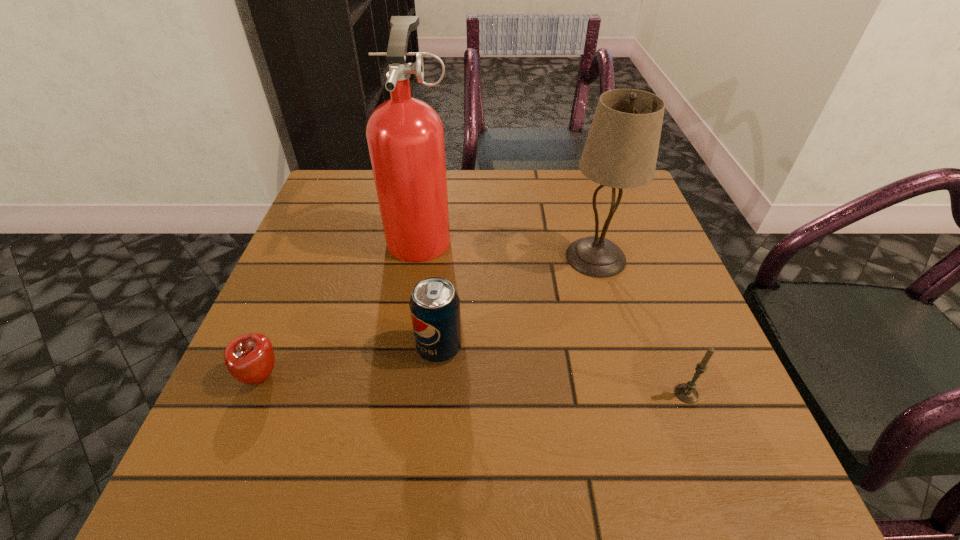
At what (x,y) coordinates should I click in order to perform the action: click on vacant space at the right edge. Please return your answer as a coordinate pair (x, y). Looking at the image, I should click on (681, 428).

You are a GUI agent. You are given a task and a screenshot of the screen. Output one action in this format:
    pyautogui.click(x=<x>, y=<y>)
    Task: Click on the vacant region at the far left corner of the desktop
    This screenshot has height=540, width=960.
    Given the screenshot: What is the action you would take?
    pyautogui.click(x=347, y=193)

The image size is (960, 540). In order to click on vacant space at the near right corner in this screenshot , I will do `click(712, 486)`.

Locate an element on the screen. The height and width of the screenshot is (540, 960). free point between the fire extinguisher and the apple is located at coordinates (341, 305).

Locate an element on the screen. free space between the lampshade and the fire extinguisher is located at coordinates (509, 246).

At what (x,y) coordinates should I click in order to perform the action: click on free space between the leftmost object and the candle. Please return your answer as a coordinate pair (x, y). Image resolution: width=960 pixels, height=540 pixels. Looking at the image, I should click on (474, 385).

At what (x,y) coordinates should I click in order to perform the action: click on vacant area that lies between the second shortest object and the fire extinguisher. Please return your answer as a coordinate pair (x, y). Looking at the image, I should click on (554, 314).

Where is `vacant area between the second tallest object and the third shortest object`? The image size is (960, 540). vacant area between the second tallest object and the third shortest object is located at coordinates (517, 303).

In order to click on vacant space that's between the fire extinguisher and the apple in this screenshot , I will do `click(341, 305)`.

Image resolution: width=960 pixels, height=540 pixels. I want to click on vacant area that lies between the lampshade and the third tallest object, so click(517, 303).